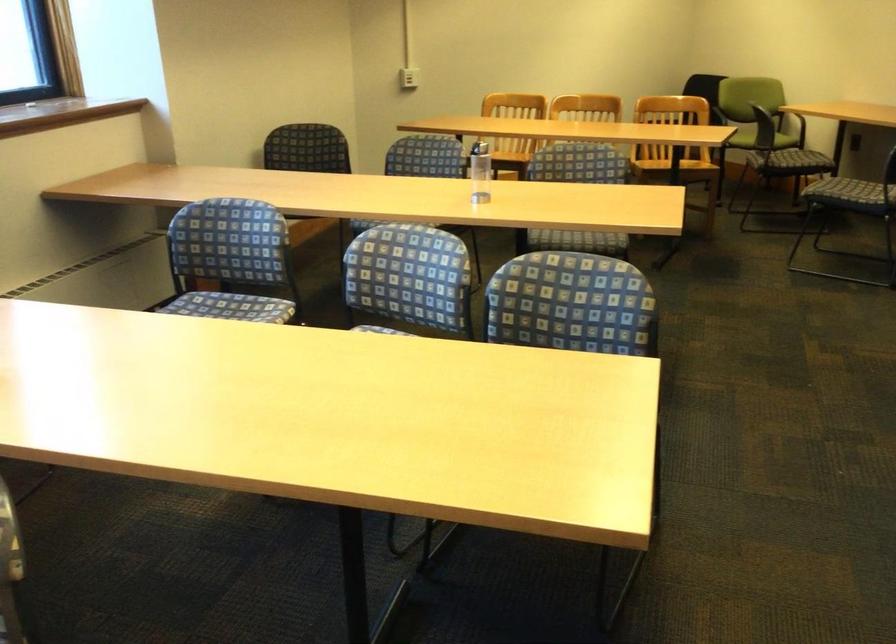
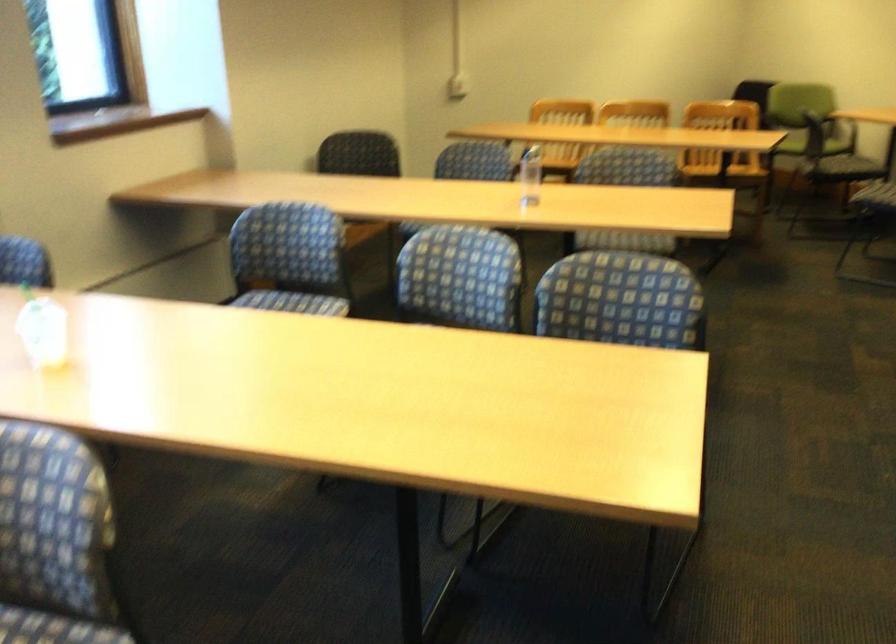
The point at (481, 172) is marked in the first image. Where is the corresponding point in the second image?

(530, 176)